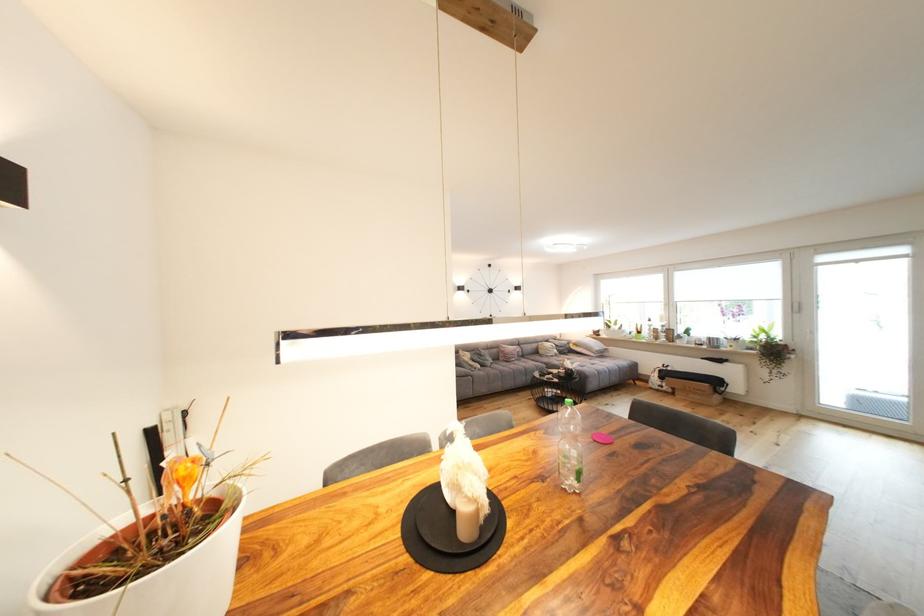
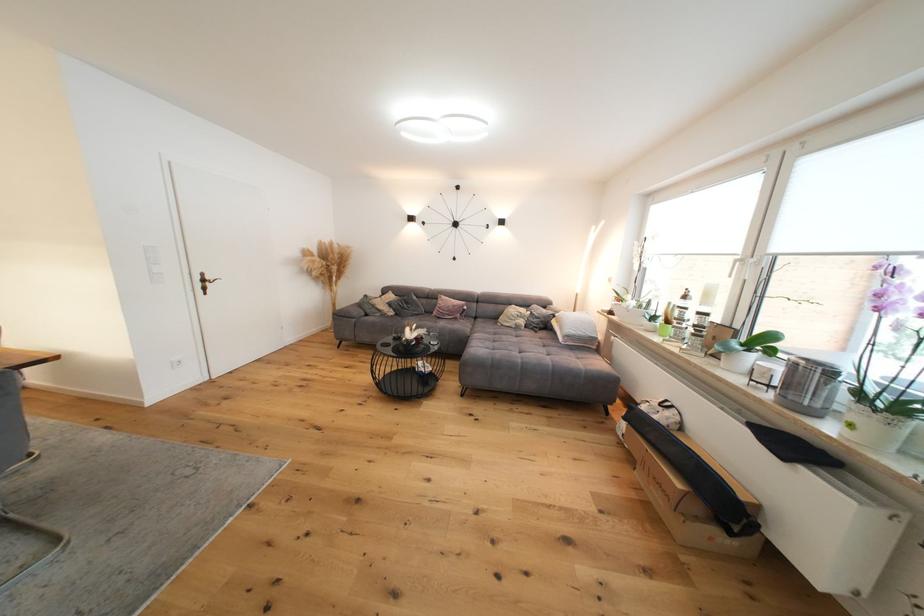
Where in the second image is the point corresponding to [508,357] from the first image?

(444, 310)